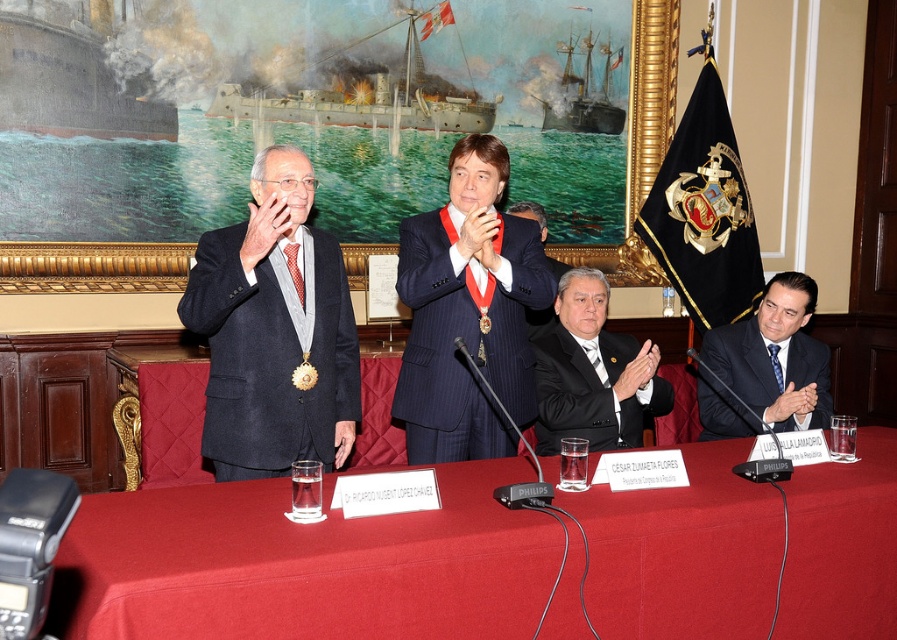
Question: Is smooth red tablecloth at center above matte black suit at left?

Choices:
 (A) yes
 (B) no

Answer: (B)

Question: Where is pinstripe suit at center located in relation to black plastic microphone at lower right in the image?

Choices:
 (A) right
 (B) left

Answer: (B)

Question: Which of the following is the closest to the observer?

Choices:
 (A) (701, 352)
 (B) (433, 420)
 (C) (297, 276)

Answer: (C)

Question: Can you confirm if pinstripe suit at center is thinner than black satin suit at center?

Choices:
 (A) yes
 (B) no

Answer: (A)

Question: Which point is farther from the camera taking this photo?

Choices:
 (A) (799, 317)
 (B) (414, 285)

Answer: (A)

Question: Among these points, which one is nearest to the camera?

Choices:
 (A) (560, 390)
 (B) (771, 355)
 (C) (518, 500)
 (D) (447, 348)

Answer: (C)